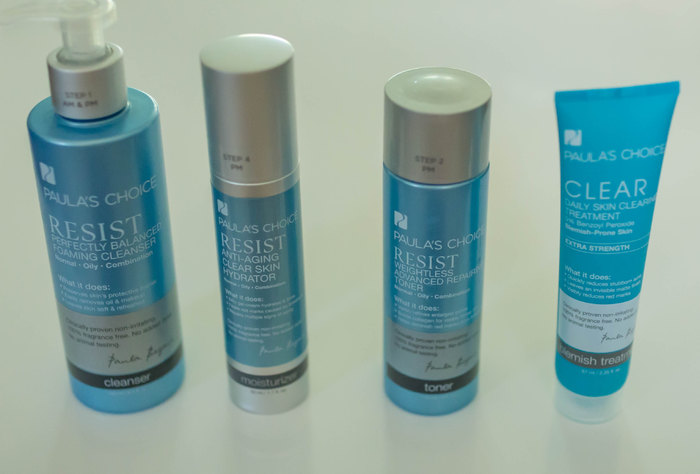
You are a GUI agent. You are given a task and a screenshot of the screen. Output one action in this format:
    pyautogui.click(x=<x>, y=<y>)
    Task: Click on the gray background color
    The image size is (700, 474).
    Given the screenshot: What is the action you would take?
    pyautogui.click(x=427, y=41)